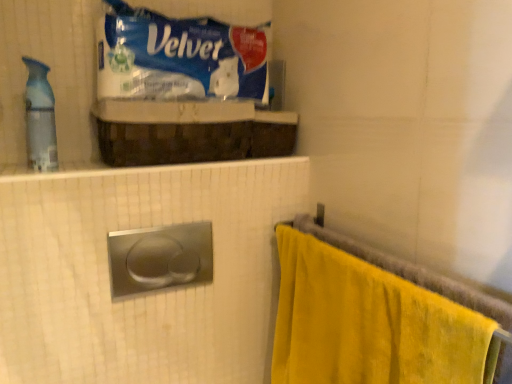
At what (x,y) coordinates should I click in order to perform the action: click on yellow velour towel at right. Please return your answer as a coordinate pair (x, y). Looking at the image, I should click on (367, 323).

Where is `translucent plastic spray bottle at left`? The image size is (512, 384). translucent plastic spray bottle at left is located at coordinates (40, 118).

Is the depth of translucent plastic spray bottle at left greater than that of blue plastic velver at upper center?

No.

From a real-world perspective, is translucent plastic spray bottle at left physically located above or below blue plastic velver at upper center?

translucent plastic spray bottle at left is situated lower than blue plastic velver at upper center in the real world.

Are translucent plastic spray bottle at left and blue plastic velver at upper center located far from each other?

No, translucent plastic spray bottle at left is not far from blue plastic velver at upper center.

Is blue plastic velver at upper center located within translucent plastic spray bottle at left?

No, blue plastic velver at upper center is not inside translucent plastic spray bottle at left.

Does yellow velour towel at right turn towards translucent plastic spray bottle at left?

No, yellow velour towel at right does not turn towards translucent plastic spray bottle at left.

From a real-world perspective, relative to translucent plastic spray bottle at left, is yellow velour towel at right vertically above or below?

Clearly, from a real-world perspective, yellow velour towel at right is below translucent plastic spray bottle at left.

How different are the orientations of yellow velour towel at right and translucent plastic spray bottle at left in degrees?

They differ by 87.4 degrees in their facing directions.

Considering the positions of objects yellow velour towel at right and translucent plastic spray bottle at left in the image provided, who is more to the left, yellow velour towel at right or translucent plastic spray bottle at left?

Positioned to the left is translucent plastic spray bottle at left.

Would you say translucent plastic spray bottle at left is a long distance from yellow velour towel at right?

That's not correct — translucent plastic spray bottle at left is a little close to yellow velour towel at right.

Which object is closer to the camera taking this photo, translucent plastic spray bottle at left or yellow velour towel at right?

yellow velour towel at right is closer to the camera.

Does point (38, 126) come behind point (451, 346)?

That is True.

Is blue plastic velver at upper center at the back of yellow velour towel at right?

No, yellow velour towel at right is not facing the opposite direction of blue plastic velver at upper center.

From a real-world perspective, who is located lower, yellow velour towel at right or blue plastic velver at upper center?

yellow velour towel at right, from a real-world perspective.

Considering the sizes of objects yellow velour towel at right and blue plastic velver at upper center in the image provided, who is thinner, yellow velour towel at right or blue plastic velver at upper center?

yellow velour towel at right.

Is yellow velour towel at right at the left side of blue plastic velver at upper center?

No.

From the picture: Between blue plastic velver at upper center and yellow velour towel at right, which one has smaller size?

Smaller between the two is blue plastic velver at upper center.

Could you tell me if blue plastic velver at upper center is turned towards yellow velour towel at right?

No, blue plastic velver at upper center is not aimed at yellow velour towel at right.

Image resolution: width=512 pixels, height=384 pixels. I want to click on towel below the blue plastic velver at upper center (from a real-world perspective), so click(x=367, y=323).

Would you say blue plastic velver at upper center is to the left or to the right of yellow velour towel at right in the picture?

Based on their positions, blue plastic velver at upper center is located to the left of yellow velour towel at right.

Which is in front, point (152, 84) or point (35, 79)?

Positioned in front is point (35, 79).

Considering the relative positions of blue plastic velver at upper center and translucent plastic spray bottle at left in the image provided, is blue plastic velver at upper center to the right of translucent plastic spray bottle at left from the viewer's perspective?

Indeed, blue plastic velver at upper center is positioned on the right side of translucent plastic spray bottle at left.

Identify the location of material that appears above the translucent plastic spray bottle at left (from a real-world perspective). (180, 57).

Image resolution: width=512 pixels, height=384 pixels. Identify the location of towel located below the translucent plastic spray bottle at left (from the image's perspective). (367, 323).

Looking at this image, based on their spatial positions, is blue plastic velver at upper center or yellow velour towel at right closer to translucent plastic spray bottle at left?

blue plastic velver at upper center is positioned closer to the anchor translucent plastic spray bottle at left.

When comparing their distances from yellow velour towel at right, does translucent plastic spray bottle at left or blue plastic velver at upper center seem further?

translucent plastic spray bottle at left is positioned further to the anchor yellow velour towel at right.

From the picture: Looking at the image, which one is located closer to blue plastic velver at upper center, translucent plastic spray bottle at left or yellow velour towel at right?

Based on the image, translucent plastic spray bottle at left appears to be nearer to blue plastic velver at upper center.

Looking at the image, which one is located closer to yellow velour towel at right, blue plastic velver at upper center or translucent plastic spray bottle at left?

blue plastic velver at upper center lies closer to yellow velour towel at right than the other object.

Based on their spatial positions, is yellow velour towel at right or translucent plastic spray bottle at left closer to blue plastic velver at upper center?

The object closer to blue plastic velver at upper center is translucent plastic spray bottle at left.

Estimate the real-world distances between objects in this image. Which object is closer to translucent plastic spray bottle at left, yellow velour towel at right or blue plastic velver at upper center?

Based on the image, blue plastic velver at upper center appears to be nearer to translucent plastic spray bottle at left.

Find the location of a particular element. cleaning product between blue plastic velver at upper center and yellow velour towel at right from top to bottom is located at coordinates (40, 118).